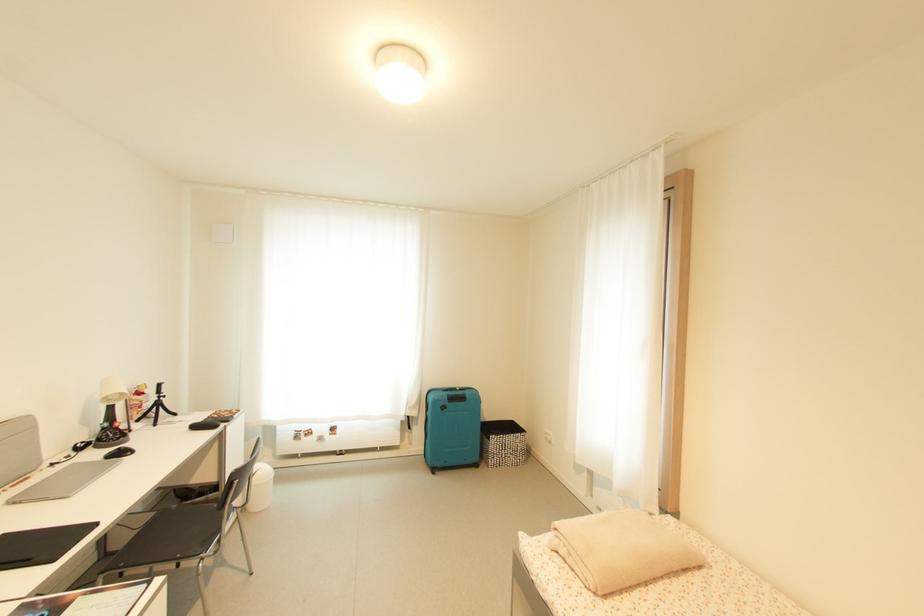
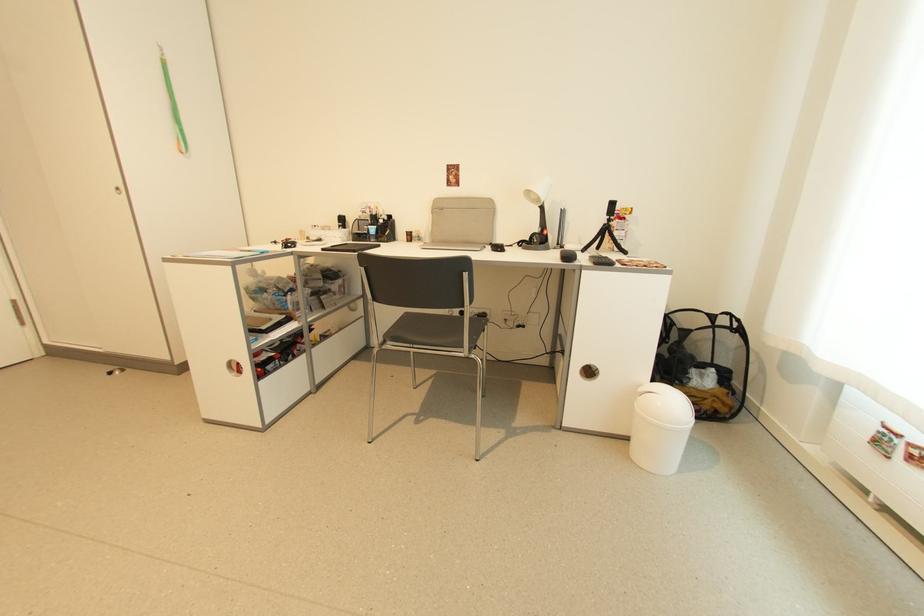
Find the pixel in the second image that matches [163,395] in the first image.

(612, 217)